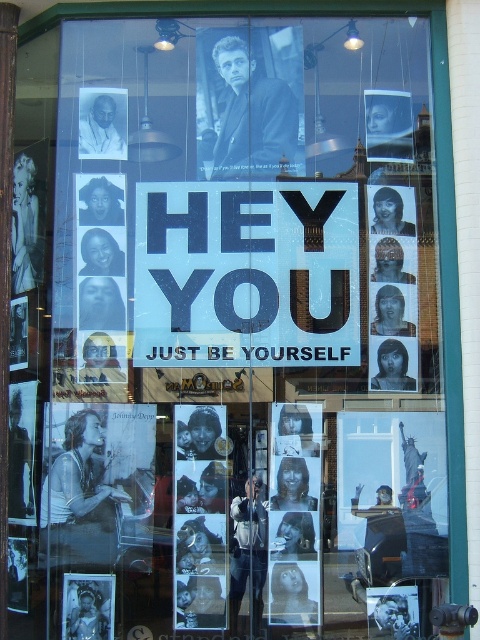
Which is in front, point (168, 314) or point (398, 307)?

Point (168, 314) is in front.

Between black paper sign at center and gray textured portrait at center, which one is positioned higher?

black paper sign at center

Is point (259, 204) in front of point (405, 321)?

No, it is not.

Image resolution: width=480 pixels, height=640 pixels. What are the coordinates of `black paper sign at center` in the screenshot? It's located at (245, 273).

Can you confirm if matte black poster at center is positioned to the right of gray textured portrait at center?

No, matte black poster at center is not to the right of gray textured portrait at center.

The height and width of the screenshot is (640, 480). Describe the element at coordinates (200, 516) in the screenshot. I see `matte black poster at center` at that location.

Where is `matte black poster at center`? matte black poster at center is located at coordinates (200, 516).

Who is taller, white glossy photo at center or smooth black jacket at center?

white glossy photo at center

Is white glossy photo at center above smooth black jacket at center?

No.

Where is `white glossy photo at center`? The height and width of the screenshot is (640, 480). white glossy photo at center is located at coordinates (294, 513).

Where is `white glossy photo at center`? This screenshot has width=480, height=640. white glossy photo at center is located at coordinates (294, 513).